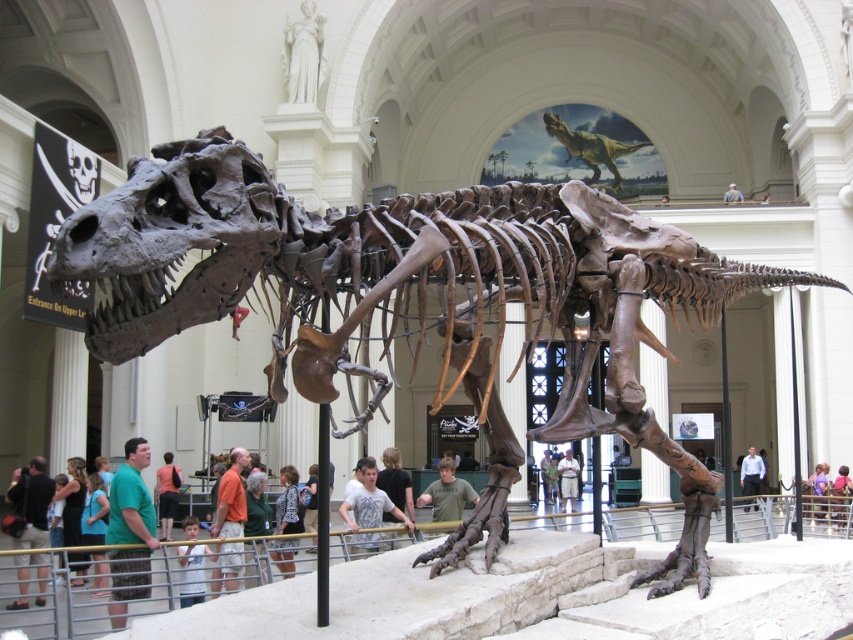
You are a visitor in the museum and see both the green fabric shirt at lower left and the black textured shirt at center. Which shirt is positioned higher in the image?

The green fabric shirt at lower left is positioned higher because it is above the black textured shirt at center.